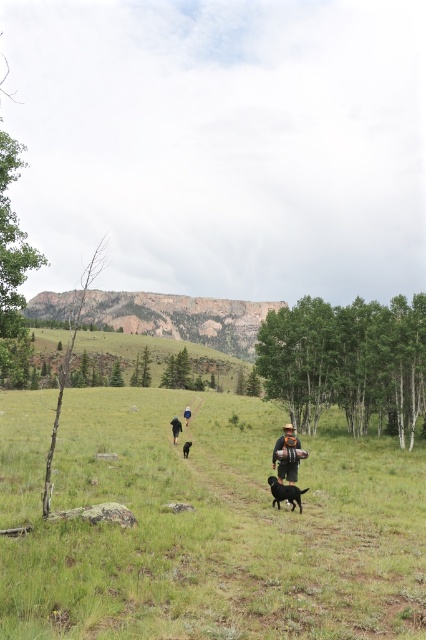
Question: Which point is closer to the camera?

Choices:
 (A) (184, 420)
 (B) (167, 544)

Answer: (B)

Question: Which object is closer to the camera taking this photo?

Choices:
 (A) green grassy field at center
 (B) black fur dog at center
 (C) black furry dog at center

Answer: (A)

Question: Is black fabric backpack at center closer to camera compared to black fur dog at center?

Choices:
 (A) no
 (B) yes

Answer: (A)

Question: Is green grassy field at center positioned in front of black furry dog at center?

Choices:
 (A) yes
 (B) no

Answer: (A)

Question: Based on their relative distances, which object is farther from the black fabric backpack at center?

Choices:
 (A) dark blue jeans at center
 (B) black fur dog at center
 (C) black furry dog at center
 (D) green grassy field at center

Answer: (C)

Question: In this image, where is green grassy field at center located relative to black fabric backpack at center?

Choices:
 (A) left
 (B) right

Answer: (B)